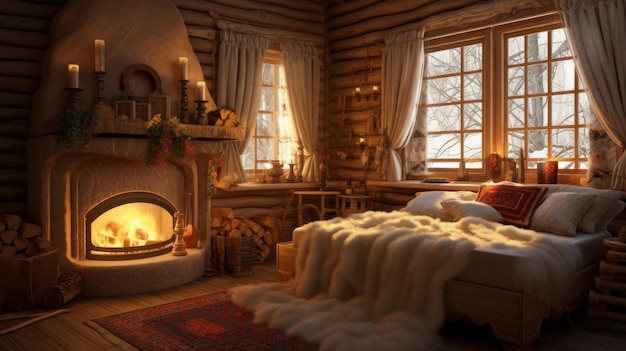
Where is `floor`? floor is located at coordinates (68, 328).